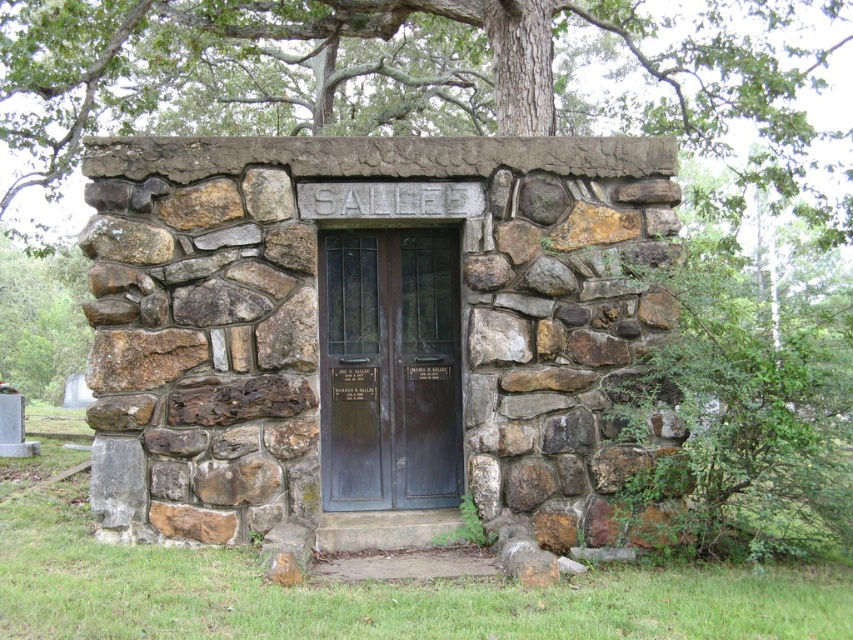
You are standing in front of the stone structure and notice a green leafy tree. Where exactly is the green leafy tree at upper center located in terms of its 2D coordinates?

The green leafy tree at upper center is located at the 2D coordinates of point [431,77].

You are standing in front of the stone structure and notice two green leafy trees in the scene. Which tree, the green leafy tree at upper center or the green leafy tree at left, is positioned to the right of the other?

The green leafy tree at upper center is to the right of the green leafy tree at left.

You are standing in front of the stone structure and want to enter the dark brown wood door at center. You notice a green leafy tree at left nearby. Which object is wider from your perspective?

The green leafy tree at left is wider than the dark brown wood door at center.